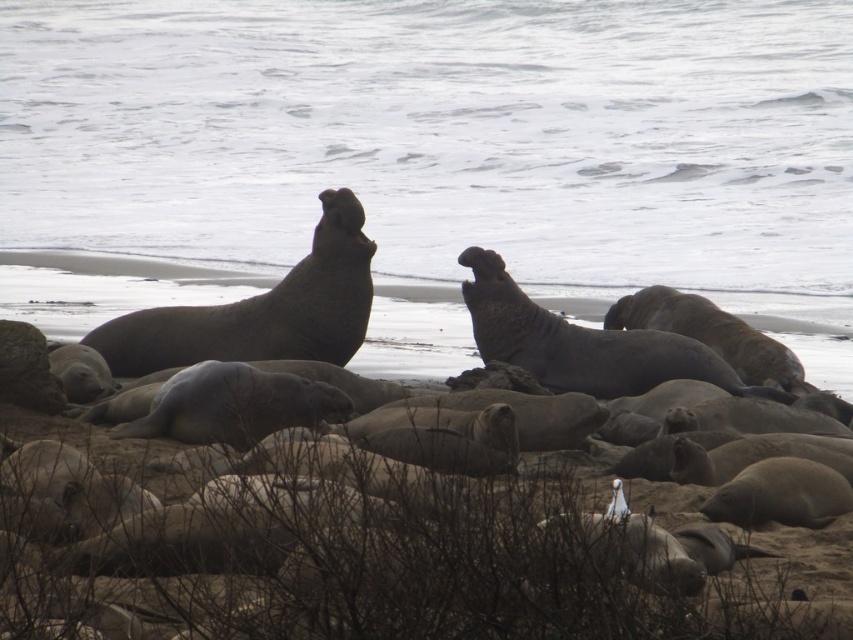
You are a wildlife photographer aiming to capture a closeup shot of the gray matte seal at upper left and the gray matte seal at center. Since you want to focus on the seal that is taller, which seal should you choose?

The gray matte seal at upper left is much taller than the gray matte seal at center, so you should focus on the gray matte seal at upper left.

You are a wildlife photographer carrying a camera bag that requires a flat surface to set up your equipment. You see the brown sandy beach at center and the gray matte seal at upper left. Which location would be suitable for setting up your equipment?

The brown sandy beach at center is suitable for setting up equipment because it provides a flat surface, whereas the gray matte seal at upper left is a living creature and not a flat surface.